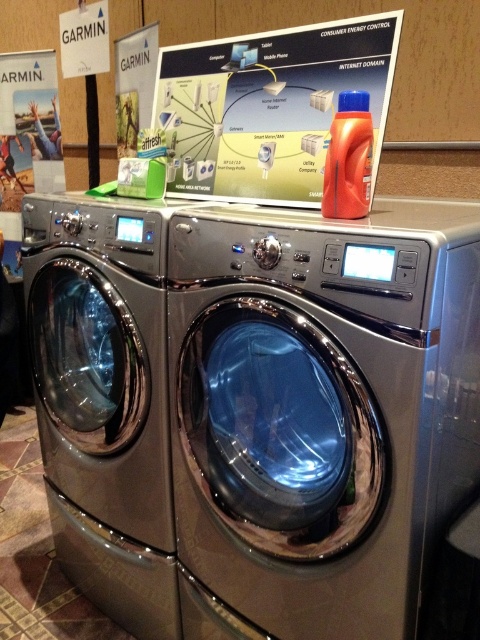
Question: Is satin silver washing machine at center above white glossy poster at center?

Choices:
 (A) no
 (B) yes

Answer: (A)

Question: Which object is positioned farthest from the satin chrome washing machine at left?

Choices:
 (A) satin silver washing machine at center
 (B) white glossy poster at center

Answer: (B)

Question: Which point appears closest to the camera in this image?

Choices:
 (A) (319, 188)
 (B) (86, 436)
 (C) (355, 374)

Answer: (C)

Question: Observing the image, what is the correct spatial positioning of satin chrome washing machine at left in reference to white glossy poster at center?

Choices:
 (A) below
 (B) above

Answer: (A)

Question: Is satin silver washing machine at center positioned at the back of white glossy poster at center?

Choices:
 (A) yes
 (B) no

Answer: (B)

Question: Which point is farther to the camera?

Choices:
 (A) (x=156, y=422)
 (B) (x=319, y=298)
 (C) (x=296, y=145)

Answer: (A)